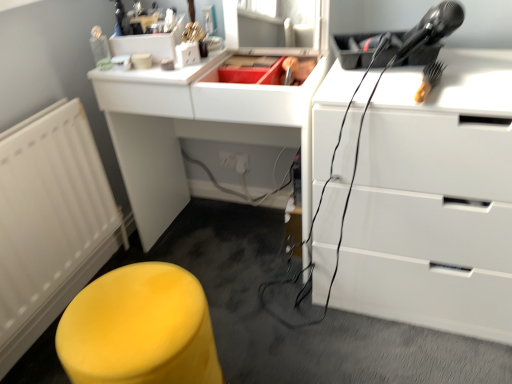
Question: From the image's perspective, relative to matte yellow stool at lower left, is white matte radiator at left above or below?

Choices:
 (A) below
 (B) above

Answer: (B)

Question: Is white matte radiator at left in front of or behind matte yellow stool at lower left in the image?

Choices:
 (A) front
 (B) behind

Answer: (B)

Question: Based on their relative distances, which object is nearer to the white matte radiator at left?

Choices:
 (A) matte yellow stool at lower left
 (B) white glossy chest of drawers at upper right
 (C) white glossy computer desk at center
 (D) yellow plastic brush at upper right

Answer: (C)

Question: Which object is the closest to the white matte radiator at left?

Choices:
 (A) matte yellow stool at lower left
 (B) yellow plastic brush at upper right
 (C) white glossy chest of drawers at upper right
 (D) white glossy computer desk at center

Answer: (D)